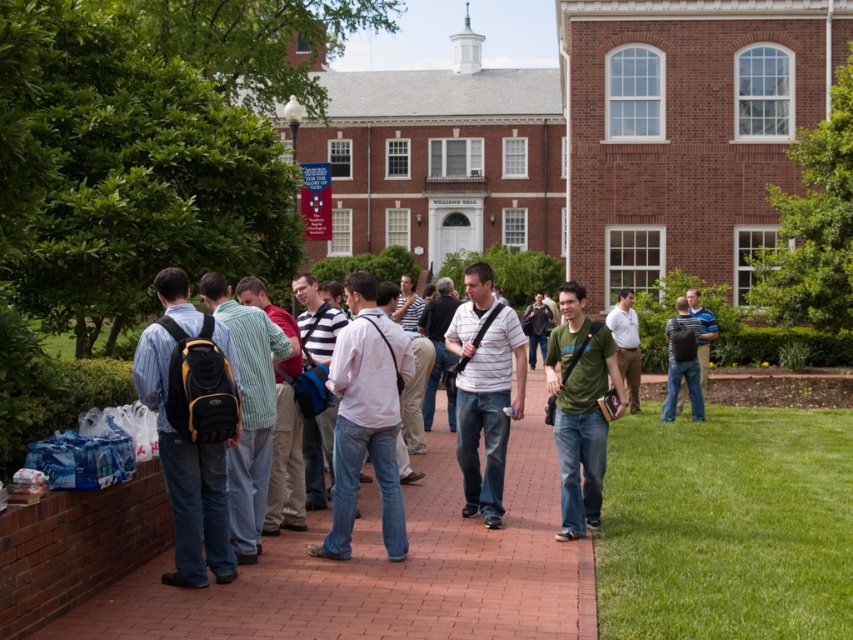
Question: Among these objects, which one is farthest from the camera?

Choices:
 (A) brick pavement at center
 (B) green grass at lower right

Answer: (B)

Question: Which point appears closest to the camera in this image?

Choices:
 (A) (706, 497)
 (B) (44, 500)

Answer: (B)

Question: Which point is closer to the camera taking this photo?

Choices:
 (A) (659, 628)
 (B) (619, 406)
 (C) (463, 572)

Answer: (A)

Question: In this image, where is brick pavement at center located relative to green grass at lower right?

Choices:
 (A) above
 (B) below

Answer: (A)

Question: Does brick pavement at center have a larger size compared to green matte shirt at center?

Choices:
 (A) yes
 (B) no

Answer: (A)

Question: Does brick pavement at center appear over green matte shirt at center?

Choices:
 (A) yes
 (B) no

Answer: (B)